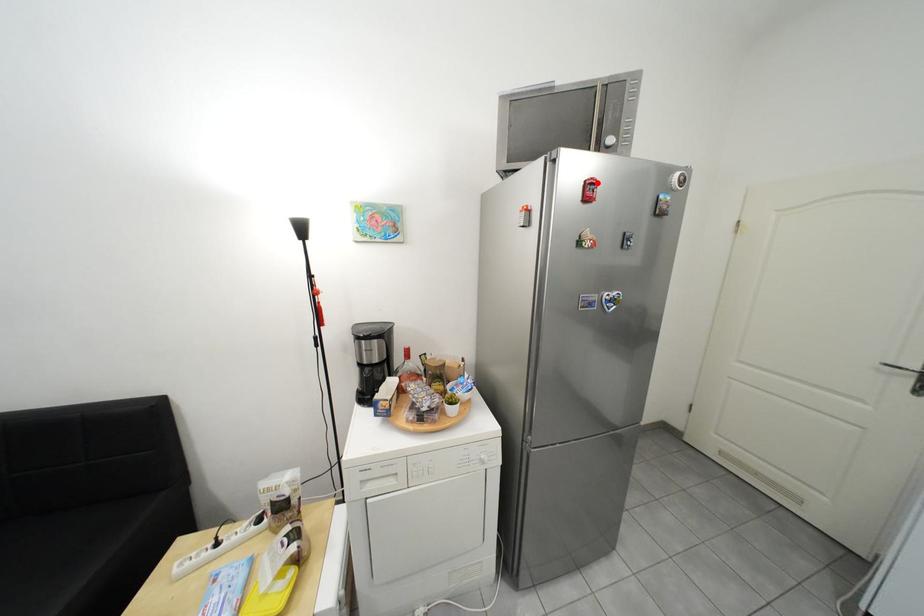
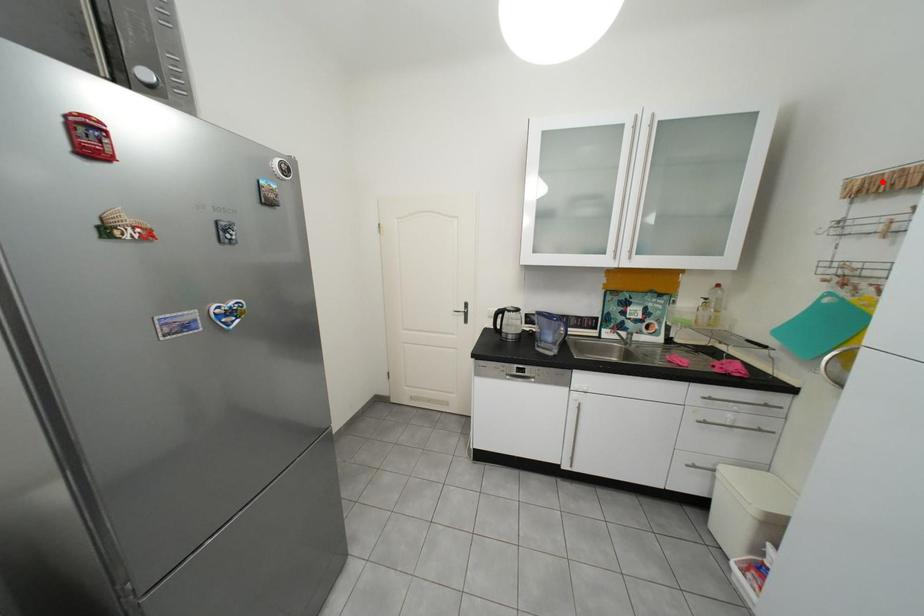
I am providing you with two images of the same scene from different viewpoints. A red point is marked on the first image and another point is marked on the second image. Are the points marked in image1 and image2 representing the same 3D position?

No